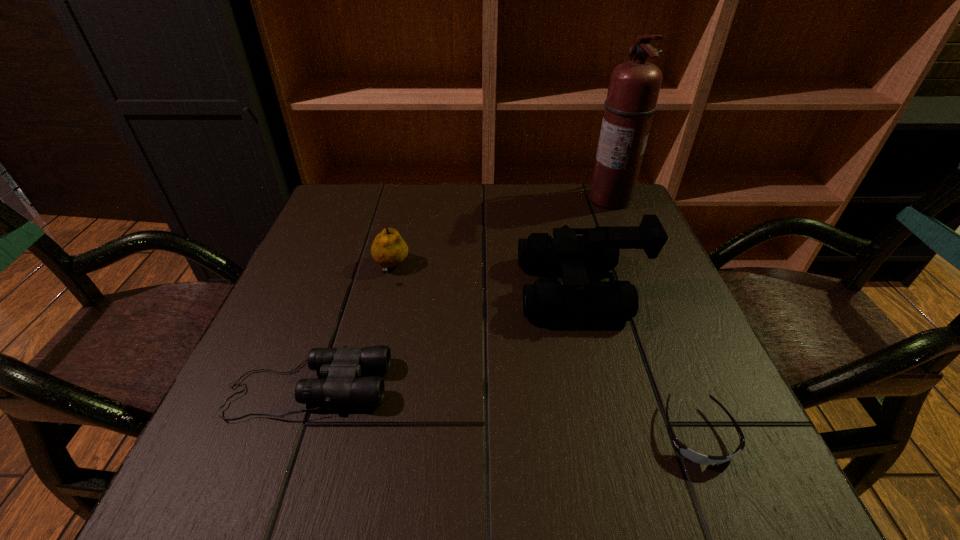
This screenshot has width=960, height=540. In the image, there is a desktop. What are the coordinates of `vacant space at the near right corner` in the screenshot? It's located at (761, 474).

Where is `vacant area between the pear and the shortest object`? Image resolution: width=960 pixels, height=540 pixels. vacant area between the pear and the shortest object is located at coordinates (544, 352).

At what (x,y) coordinates should I click in order to perform the action: click on empty space between the shortest object and the fire extinguisher. Please return your answer as a coordinate pair (x, y). The image size is (960, 540). Looking at the image, I should click on (654, 316).

You are a GUI agent. You are given a task and a screenshot of the screen. Output one action in this format:
    pyautogui.click(x=<x>, y=<y>)
    Task: Click on the empty space between the farther binoculars and the third tallest object
    The width and height of the screenshot is (960, 540).
    Given the screenshot: What is the action you would take?
    pyautogui.click(x=486, y=279)

At what (x,y) coordinates should I click in order to perform the action: click on free space between the third tallest object and the shortest object. Please return your answer as a coordinate pair (x, y). This screenshot has width=960, height=540. Looking at the image, I should click on (544, 352).

Locate an element on the screen. Image resolution: width=960 pixels, height=540 pixels. free space between the third shortest object and the farthest object is located at coordinates (501, 234).

This screenshot has height=540, width=960. In order to click on free space between the shortest object and the taller binoculars in this screenshot , I will do `click(639, 362)`.

In order to click on vacant space in between the farthest object and the left binoculars in this screenshot , I will do `click(460, 293)`.

I want to click on the third closest object to the farther binoculars, so click(388, 249).

Identify which object is the third closest to the second tallest object. Please provide its 2D coordinates. Your answer should be formatted as a tuple, i.e. [(x, y)], where the tuple contains the x and y coordinates of a point satisfying the conditions above.

[(388, 249)]